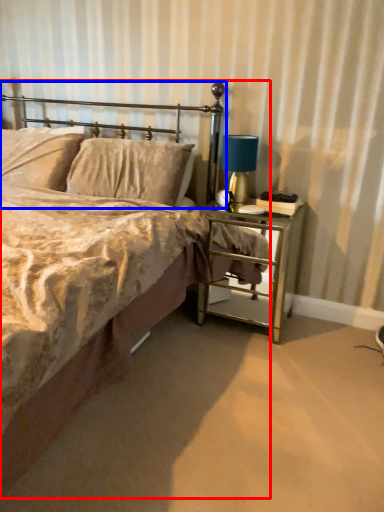
Question: Which object is further to the camera taking this photo, bed (highlighted by a red box) or headboard (highlighted by a blue box)?

Choices:
 (A) bed
 (B) headboard

Answer: (B)